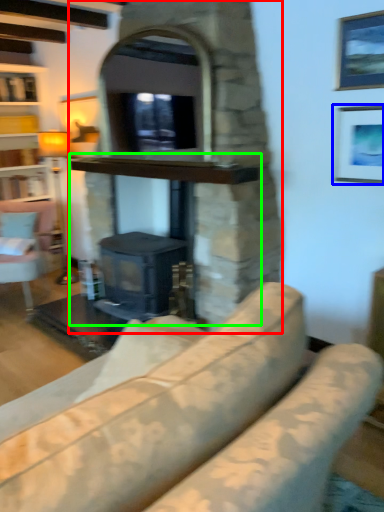
Question: Which object is the farthest from fireplace (highlighted by a red box)? Choose among these: picture frame (highlighted by a blue box) or fireplace (highlighted by a green box).

Choices:
 (A) picture frame
 (B) fireplace

Answer: (A)